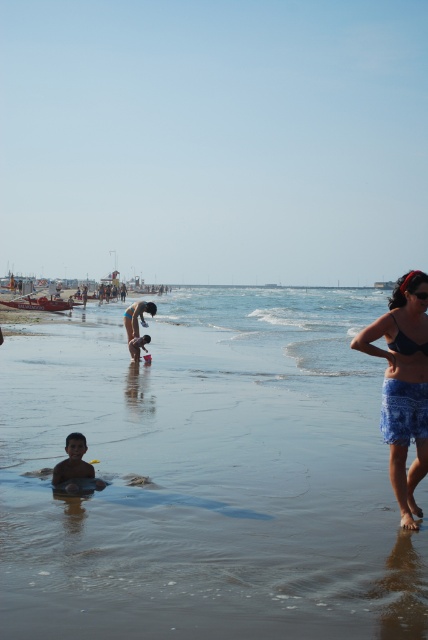
You are a lifeguard on duty and need to quickly reach both the smooth sand beach at center and the smooth sand at lower center to assist swimmers. Given that you can run at 5 meters per second, how long will it take you to reach each location from your current position at the lifeguard stand?

The smooth sand beach at center and smooth sand at lower center are 11.31 meters apart. Since you can run at 5 meters per second, it would take approximately 2.26 seconds to reach each location. However, the exact time depends on the distance from your current position to each specific point.

You are a photographer trying to capture a shot of the blue printed skirt at lower right and the matte black swimsuit at center. Based on their positions, which object is closer to the bottom edge of the photo?

The blue printed skirt at lower right is closer to the bottom edge of the photo because it is positioned below the matte black swimsuit at center.

You are a photographer trying to capture a wide shot of the beach scene. The smooth sand beach at center and the matte black swimsuit at center are both in your frame. Which object occupies more horizontal space in the photo?

The smooth sand beach at center occupies more horizontal space in the photo because its width surpasses that of the matte black swimsuit at center.